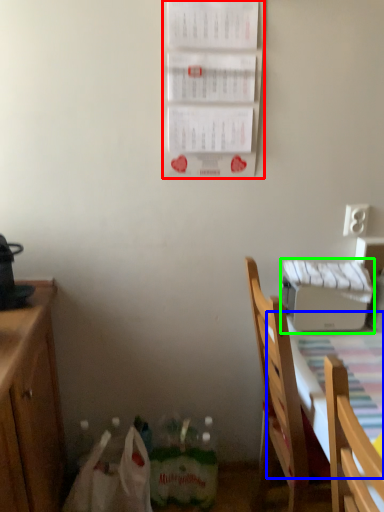
Question: Based on their relative distances, which object is nearer to bulletin board (highlighted by a red box)? Choose from tablecloth (highlighted by a blue box) and appliance (highlighted by a green box).

Choices:
 (A) tablecloth
 (B) appliance

Answer: (B)